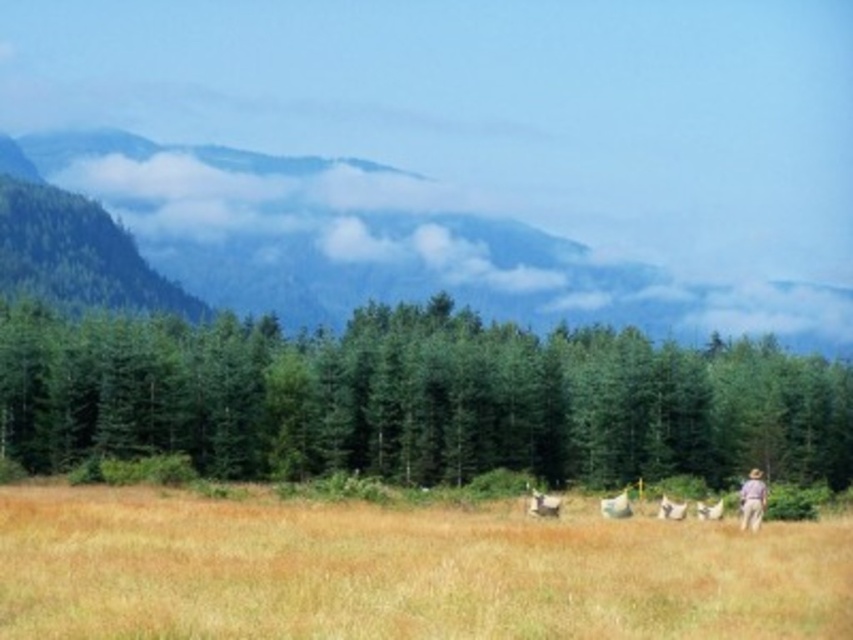
Does green forested mountain at upper left appear over white fluffy sheep at lower right?

Yes, green forested mountain at upper left is above white fluffy sheep at lower right.

Is green forested mountain at upper left shorter than white fluffy sheep at lower right?

No, green forested mountain at upper left is not shorter than white fluffy sheep at lower right.

Does point (314, 195) lie behind point (715, 504)?

Yes, it is behind point (715, 504).

Find the location of `green forested mountain at upper left`. green forested mountain at upper left is located at coordinates (386, 244).

Which is more to the left, brown grassy pasture at lower center or white fluffy sheep at center?

From the viewer's perspective, brown grassy pasture at lower center appears more on the left side.

Is brown grassy pasture at lower center above white fluffy sheep at center?

Yes, brown grassy pasture at lower center is above white fluffy sheep at center.

Does point (370, 566) come behind point (550, 515)?

No, (370, 566) is closer to viewer.

Where is `brown grassy pasture at lower center`? The height and width of the screenshot is (640, 853). brown grassy pasture at lower center is located at coordinates (402, 570).

Is the position of green textured trees at center more distant than that of white fluffy sheep at lower right?

Yes, it is.

Is green textured trees at center wider than white fluffy sheep at lower right?

Yes, green textured trees at center is wider than white fluffy sheep at lower right.

Image resolution: width=853 pixels, height=640 pixels. Identify the location of green textured trees at center. (415, 397).